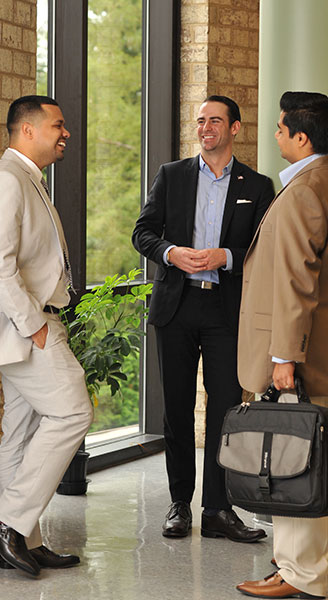
You are a GUI agent. You are given a task and a screenshot of the screen. Output one action in this format:
    pyautogui.click(x=<x>, y=<y>)
    Task: Click on the potted plant
    The image size is (328, 600).
    Given the screenshot: What is the action you would take?
    pyautogui.click(x=86, y=357)